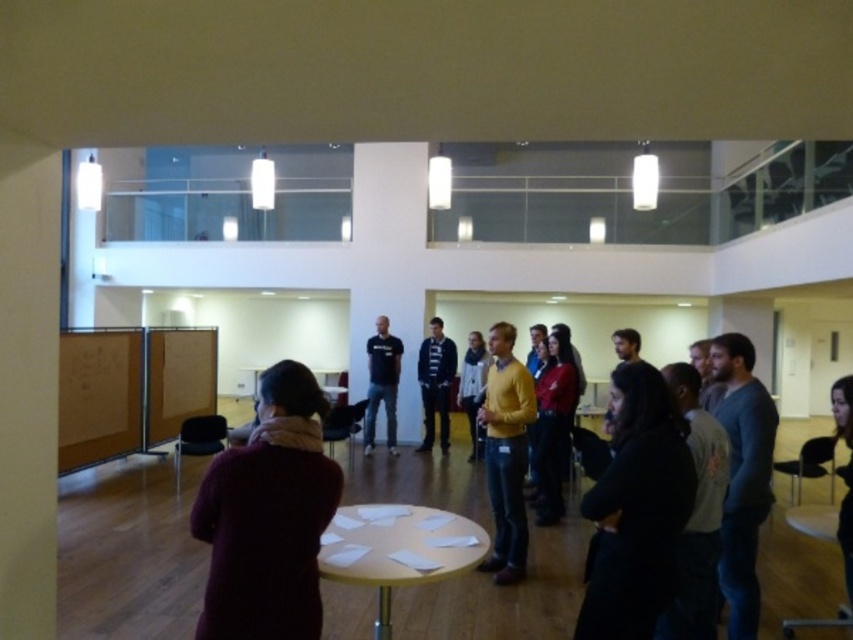
Question: Does maroon woolen sweater at center appear on the right side of light brown wooden table at center?

Choices:
 (A) no
 (B) yes

Answer: (A)

Question: Is maroon woolen sweater at center thinner than dark blue sweater at center?

Choices:
 (A) yes
 (B) no

Answer: (A)

Question: Does light brown wooden table at center have a lesser width compared to black matte shirt at center?

Choices:
 (A) yes
 (B) no

Answer: (B)

Question: Which object is closer to the camera taking this photo?

Choices:
 (A) light brown wooden table at center
 (B) black matte shirt at center
 (C) dark blue sweater at center
 (D) maroon woolen sweater at center

Answer: (D)

Question: Which point is closer to the camera?

Choices:
 (A) (351, 509)
 (B) (230, 608)

Answer: (B)

Question: Which point is farther from the camera taking this photo?

Choices:
 (A) (372, 355)
 (B) (345, 552)
 (C) (282, 554)
 (D) (428, 438)

Answer: (D)